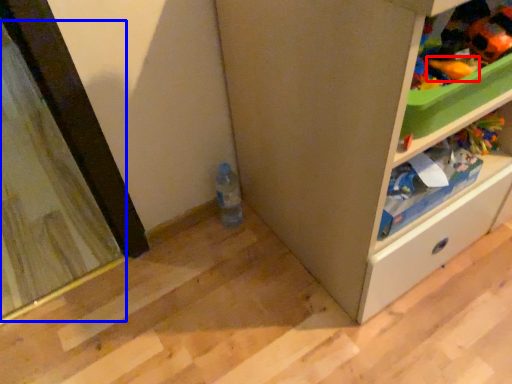
Question: Among these objects, which one is nearest to the camera, toy (highlighted by a red box) or screen door (highlighted by a blue box)?

Choices:
 (A) toy
 (B) screen door

Answer: (A)